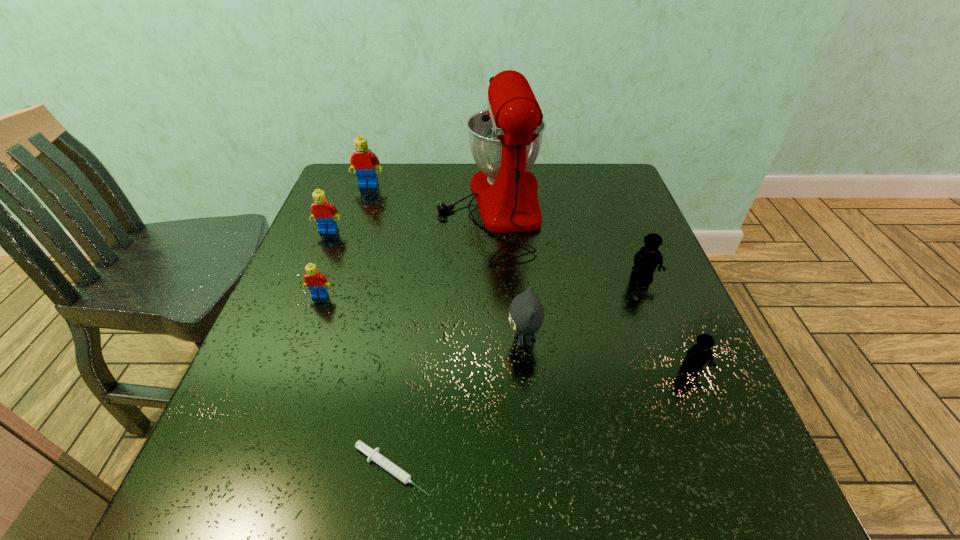
The width and height of the screenshot is (960, 540). In order to click on the nearer yellow Lego in this screenshot , I will do `click(700, 353)`.

You are a GUI agent. You are given a task and a screenshot of the screen. Output one action in this format:
    pyautogui.click(x=<x>, y=<y>)
    Task: Click on the smallest red Lego
    The image size is (960, 540).
    Given the screenshot: What is the action you would take?
    pyautogui.click(x=316, y=282)

I want to click on the nearest red Lego, so click(x=316, y=282).

The width and height of the screenshot is (960, 540). I want to click on syringe, so click(x=373, y=455).

Where is `the nearest object`? This screenshot has width=960, height=540. the nearest object is located at coordinates (373, 455).

This screenshot has width=960, height=540. I want to click on free space located on the bowl side of the mixer, so click(322, 208).

Where is `free point located on the bowl side of the mixer`? The width and height of the screenshot is (960, 540). free point located on the bowl side of the mixer is located at coordinates (394, 208).

Image resolution: width=960 pixels, height=540 pixels. Find the location of `vacant area situated 0.080m on the bowl side of the mixer`. vacant area situated 0.080m on the bowl side of the mixer is located at coordinates (409, 208).

This screenshot has height=540, width=960. In order to click on vacant space located 0.360m on the face of the seventh shortest object in this screenshot , I will do `click(339, 271)`.

At what (x,y) coordinates should I click in order to perform the action: click on free space located 0.220m on the face of the second nearest red Lego. Please return your answer as a coordinate pair (x, y). The image size is (960, 540). Looking at the image, I should click on (302, 295).